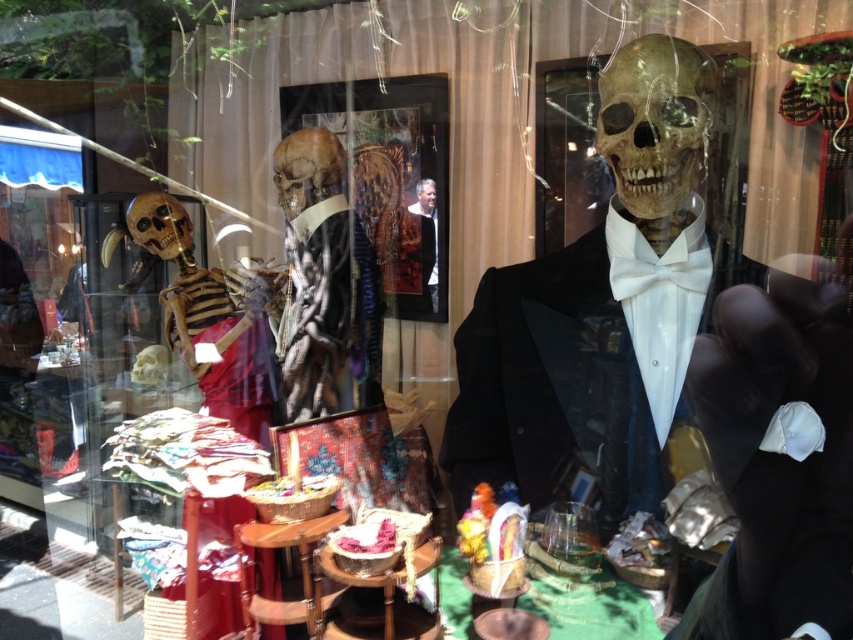
Which is more to the right, smooth beige skull at center or white satin bow tie at center?

white satin bow tie at center is more to the right.

Which is more to the left, smooth beige skull at center or white satin bow tie at center?

Positioned to the left is smooth beige skull at center.

Locate an element on the screen. smooth beige skull at center is located at coordinates (654, 122).

Does white satin bow tie at center appear on the right side of smooth leather jacket at center?

Indeed, white satin bow tie at center is positioned on the right side of smooth leather jacket at center.

Which is behind, point (639, 250) or point (434, 248)?

Point (434, 248)

Which is in front, point (634, 282) or point (425, 292)?

Positioned in front is point (634, 282).

The image size is (853, 640). What are the coordinates of `white satin bow tie at center` in the screenshot? It's located at pyautogui.click(x=656, y=266).

Which is above, matte black tuxedo at center or matte brown skeleton at center?

matte brown skeleton at center is higher up.

Who is positioned more to the left, matte black tuxedo at center or matte brown skeleton at center?

matte brown skeleton at center is more to the left.

Is point (584, 236) positioned after point (334, 244)?

No.

Identify the location of matte black tuxedo at center. The height and width of the screenshot is (640, 853). (596, 307).